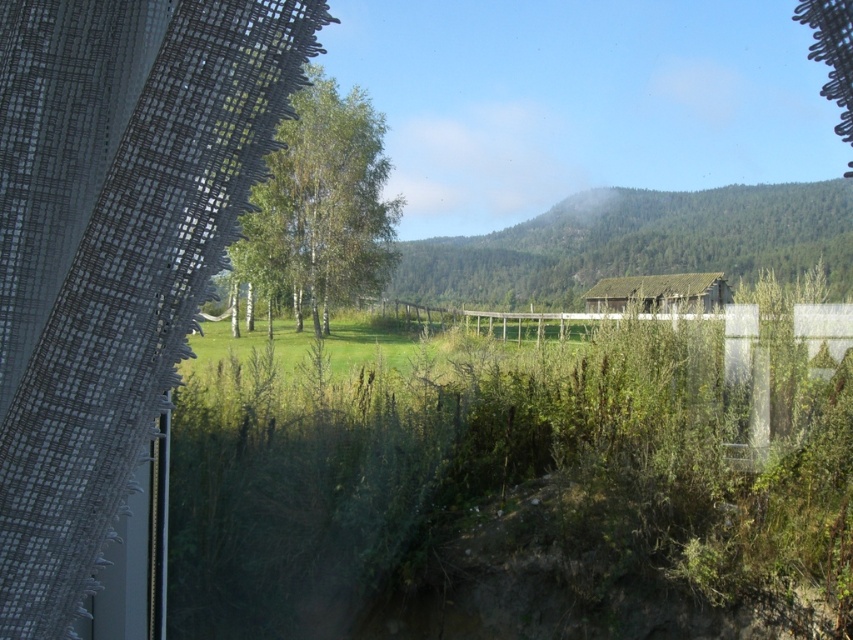
You are a painter standing in front of the window with the textured curtain partially obscuring the left side. You want to paint the green leafy tree at center and the rustic wooden hut at center. Which object should you focus on first if you want to paint the taller one first?

The green leafy tree at center is taller than rustic wooden hut at center, so you should focus on painting the green leafy tree at center first.

You are standing in a room looking through a window with a curtain. You notice two points marked on the window glass at coordinates point (648, 198) and point (641, 298). Which point is closer to you?

Point (648, 198) is further to the viewer than point (641, 298), so the point closer to you is point (641, 298).